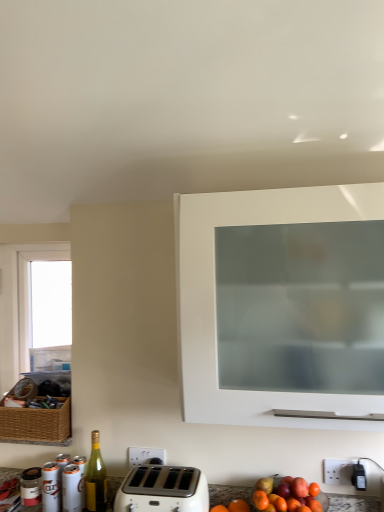
Question: Is green glass bottle at lower left at the right side of white plastic toaster at lower center?

Choices:
 (A) no
 (B) yes

Answer: (A)

Question: From the image's perspective, does green glass bottle at lower left appear lower than white plastic toaster at lower center?

Choices:
 (A) yes
 (B) no

Answer: (B)

Question: Is green glass bottle at lower left smaller than white plastic toaster at lower center?

Choices:
 (A) yes
 (B) no

Answer: (A)

Question: Is white plastic toaster at lower center inside green glass bottle at lower left?

Choices:
 (A) no
 (B) yes

Answer: (A)

Question: From the image's perspective, does green glass bottle at lower left appear higher than white plastic toaster at lower center?

Choices:
 (A) yes
 (B) no

Answer: (A)

Question: Can you confirm if green glass bottle at lower left is bigger than white plastic toaster at lower center?

Choices:
 (A) yes
 (B) no

Answer: (B)

Question: From a real-world perspective, is white plastic toaster at lower center physically below transparent glass window at left?

Choices:
 (A) yes
 (B) no

Answer: (A)

Question: Is white plastic toaster at lower center aimed at transparent glass window at left?

Choices:
 (A) yes
 (B) no

Answer: (B)

Question: Considering the relative sizes of white plastic toaster at lower center and transparent glass window at left in the image provided, is white plastic toaster at lower center shorter than transparent glass window at left?

Choices:
 (A) yes
 (B) no

Answer: (A)

Question: Is white plastic toaster at lower center closer to the viewer compared to transparent glass window at left?

Choices:
 (A) yes
 (B) no

Answer: (A)

Question: Is white plastic toaster at lower center taller than transparent glass window at left?

Choices:
 (A) no
 (B) yes

Answer: (A)

Question: Would you say white plastic toaster at lower center is outside transparent glass window at left?

Choices:
 (A) no
 (B) yes

Answer: (B)

Question: Can you confirm if transparent glass window at left is taller than white plastic toaster at lower center?

Choices:
 (A) no
 (B) yes

Answer: (B)